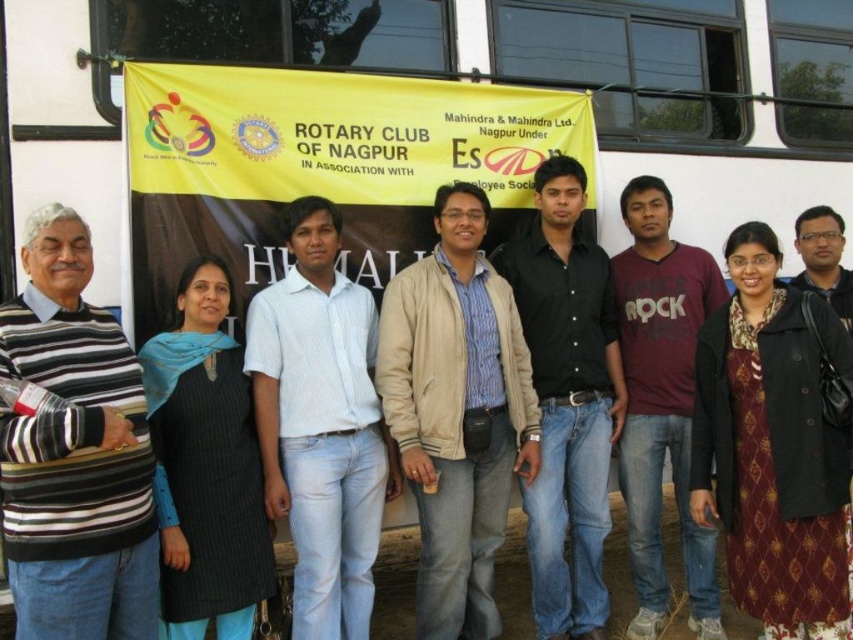
Question: Among these objects, which one is farthest from the camera?

Choices:
 (A) maroon silk dress at center
 (B) beige cotton jacket at center

Answer: (B)

Question: Is black textured dress at center to the right of dark brown leather jacket at right from the viewer's perspective?

Choices:
 (A) yes
 (B) no

Answer: (B)

Question: Can you confirm if black smooth shirt at center is smaller than maroon cotton t-shirt at center?

Choices:
 (A) yes
 (B) no

Answer: (B)

Question: Which object is closer to the camera taking this photo?

Choices:
 (A) striped sweater at left
 (B) maroon cotton t-shirt at center
 (C) dark brown leather jacket at right

Answer: (A)

Question: Does beige cotton jacket at center lie in front of white cotton shirt at center?

Choices:
 (A) yes
 (B) no

Answer: (B)

Question: Which object is closer to the camera taking this photo?

Choices:
 (A) striped sweater at left
 (B) black smooth shirt at center

Answer: (A)